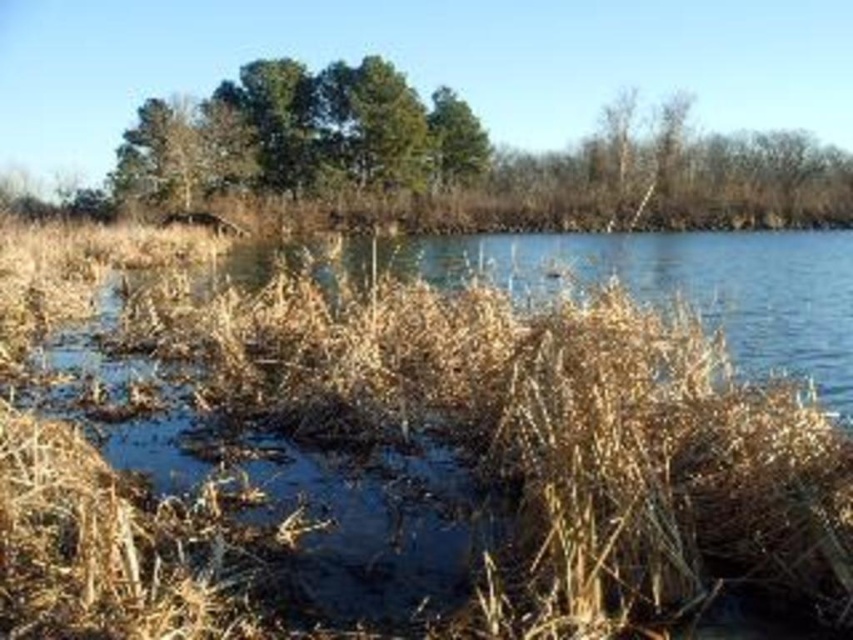
You are standing at the edge of the brown grassy river at center and want to walk towards the green leafy trees at upper center. Which direction should you head?

You should head to the left because the brown grassy river at center is to the right of the green leafy trees at upper center, so moving left will take you towards them.

You are standing at the edge of a natural landscape and want to cross the brown grassy river at center. If your walking distance is limited to 4 meters before needing to rest, can you safely cross it without exceeding your limit?

The brown grassy river at center is 3.94 meters away from viewer. Since your walking distance limit is 4 meters, you can safely cross it without exceeding your limit.